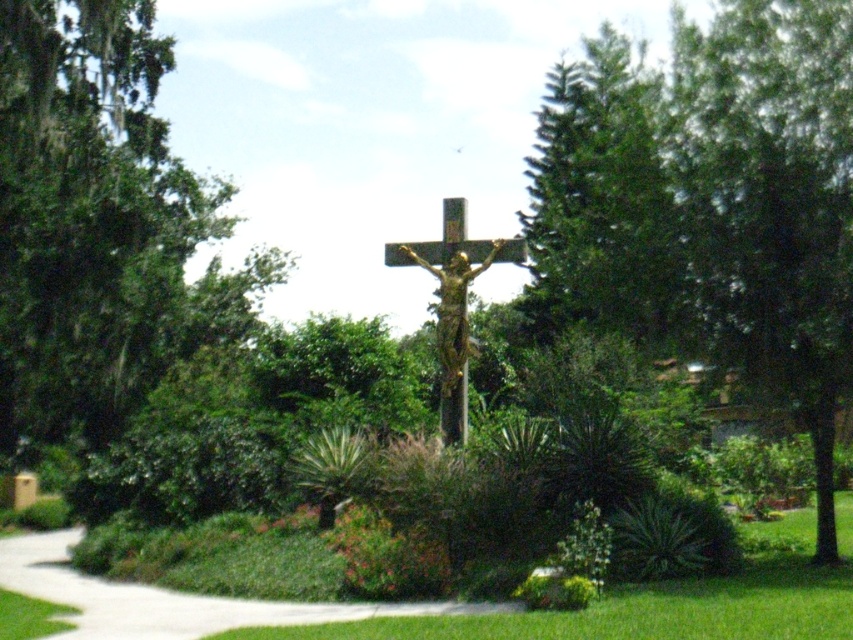
Question: Does green grass at center appear on the right side of white concrete path at center?

Choices:
 (A) no
 (B) yes

Answer: (B)

Question: Is white concrete path at center wider than gold textured crucifix at center?

Choices:
 (A) yes
 (B) no

Answer: (A)

Question: Can you confirm if green leafy tree at left is positioned to the right of gold textured crucifix at center?

Choices:
 (A) no
 (B) yes

Answer: (A)

Question: Considering the real-world distances, which object is farthest from the gold textured crucifix at center?

Choices:
 (A) green leafy tree at center
 (B) green leafy tree at left

Answer: (B)

Question: Based on their relative distances, which object is farther from the white concrete path at center?

Choices:
 (A) gold textured crucifix at center
 (B) green leafy tree at left
 (C) green leafy tree at center
 (D) green grass at center

Answer: (C)

Question: Among these objects, which one is nearest to the camera?

Choices:
 (A) gold textured crucifix at center
 (B) green leafy tree at center
 (C) green leafy tree at left
 (D) green grass at center

Answer: (D)